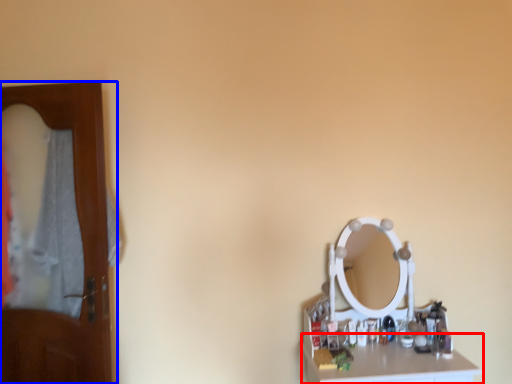
Question: Which object appears farthest to the camera in this image, counter top (highlighted by a red box) or door (highlighted by a blue box)?

Choices:
 (A) counter top
 (B) door

Answer: (B)